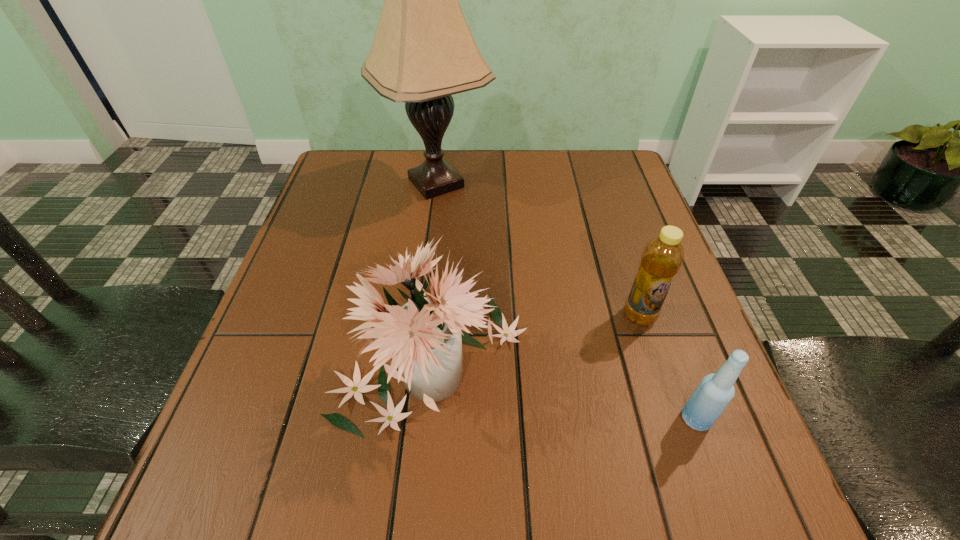
Identify the location of lamp. click(x=423, y=52).

The image size is (960, 540). I want to click on the tallest object, so click(x=423, y=52).

Image resolution: width=960 pixels, height=540 pixels. What are the coordinates of `the second tallest object` in the screenshot? It's located at (424, 338).

Identify the location of the farther bottle. The height and width of the screenshot is (540, 960). (662, 257).

Locate an element on the screen. This screenshot has height=540, width=960. the taller bottle is located at coordinates (662, 257).

You are a GUI agent. You are given a task and a screenshot of the screen. Output one action in this format:
    pyautogui.click(x=<x>, y=<y>)
    Task: Click on the shortest object
    The height and width of the screenshot is (540, 960).
    Given the screenshot: What is the action you would take?
    pyautogui.click(x=715, y=391)

This screenshot has height=540, width=960. I want to click on the nearer bottle, so click(715, 391).

Identify the location of vacant region located 0.060m on the front of the tallest object. The width and height of the screenshot is (960, 540). (430, 233).

The image size is (960, 540). Find the location of `free space located 0.100m on the right of the bouquet`. free space located 0.100m on the right of the bouquet is located at coordinates (586, 360).

At what (x,y) coordinates should I click in order to perform the action: click on free space located 0.240m on the left of the second shortest object. Please return your answer as a coordinate pair (x, y). Looking at the image, I should click on (502, 316).